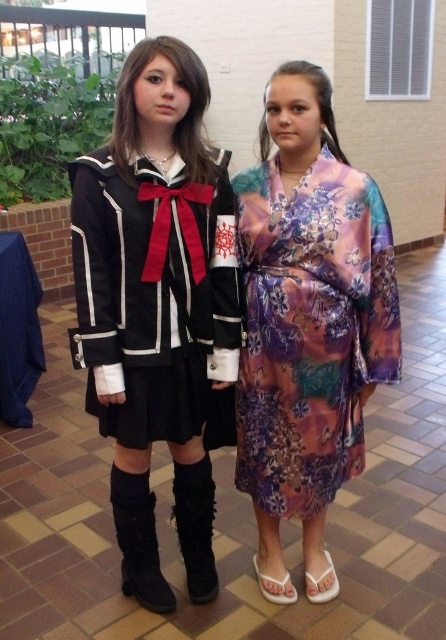
Question: Does floral silk kimono at center appear on the right side of black suede boot at lower center?

Choices:
 (A) yes
 (B) no

Answer: (A)

Question: Is satin black dress at center positioned at the back of black suede boot at lower left?

Choices:
 (A) yes
 (B) no

Answer: (B)

Question: Which object appears closest to the camera in this image?

Choices:
 (A) black suede boot at lower center
 (B) black suede boot at lower left
 (C) satin black dress at center
 (D) floral silk kimono at center

Answer: (C)

Question: Is black suede boot at lower left to the right of black suede boot at lower center from the viewer's perspective?

Choices:
 (A) no
 (B) yes

Answer: (A)

Question: Among these points, which one is nearest to the camera?

Choices:
 (A) (313, 141)
 (B) (136, 493)
 (C) (193, 490)

Answer: (A)

Question: Estimate the real-world distances between objects in this image. Which object is farther from the black suede boot at lower left?

Choices:
 (A) satin black dress at center
 (B) floral silk kimono at center
 (C) black suede boot at lower center

Answer: (B)